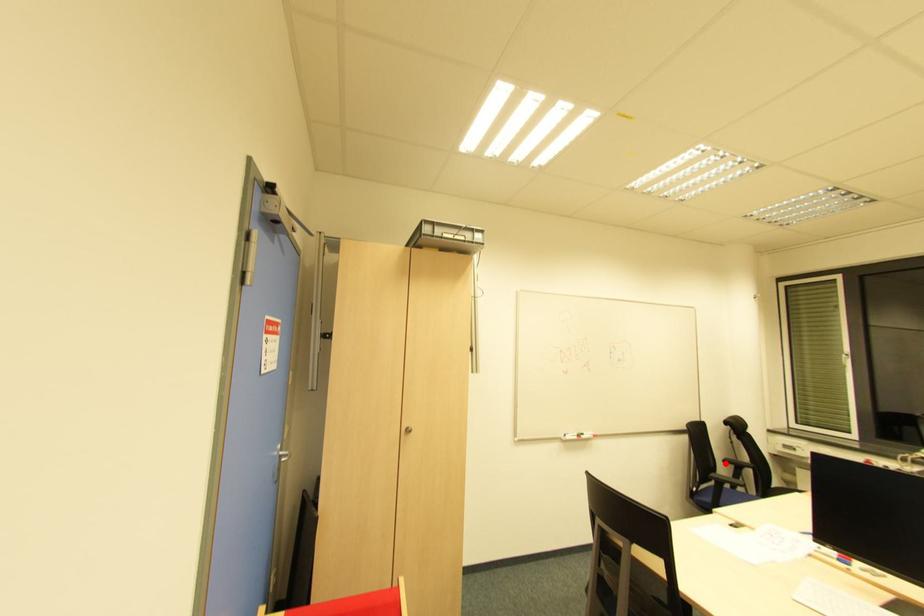
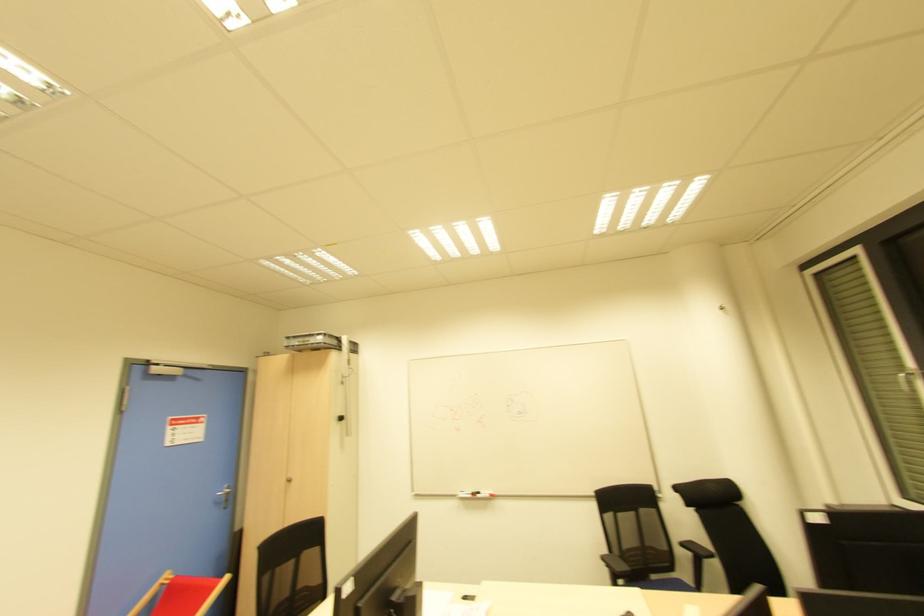
The point at the highlighted location is marked in the first image. Where is the corresponding point in the second image?

(681, 545)